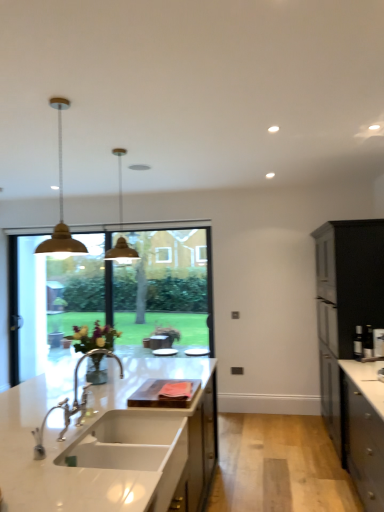
Question: Can you confirm if white glossy sink at center is smaller than gold matte pendant light at upper left?

Choices:
 (A) no
 (B) yes

Answer: (A)

Question: Can you confirm if white glossy sink at center is thinner than gold matte pendant light at upper left?

Choices:
 (A) no
 (B) yes

Answer: (A)

Question: Is gold matte pendant light at upper left located within white glossy sink at center?

Choices:
 (A) yes
 (B) no

Answer: (B)

Question: From the image's perspective, is white glossy sink at center above gold matte pendant light at upper left?

Choices:
 (A) yes
 (B) no

Answer: (B)

Question: Is white glossy sink at center behind gold matte pendant light at upper left?

Choices:
 (A) yes
 (B) no

Answer: (B)

Question: Is white glossy sink at center positioned in front of gold matte pendant light at upper left?

Choices:
 (A) yes
 (B) no

Answer: (A)

Question: Is black matte cabinet at right beside white marble countertop at center?

Choices:
 (A) no
 (B) yes

Answer: (A)

Question: Is white marble countertop at center at the back of black matte cabinet at right?

Choices:
 (A) no
 (B) yes

Answer: (A)

Question: From the image's perspective, is black matte cabinet at right located beneath white marble countertop at center?

Choices:
 (A) no
 (B) yes

Answer: (A)

Question: Can you confirm if black matte cabinet at right is bigger than white marble countertop at center?

Choices:
 (A) no
 (B) yes

Answer: (A)

Question: Does black matte cabinet at right lie in front of white marble countertop at center?

Choices:
 (A) yes
 (B) no

Answer: (B)

Question: Is black matte cabinet at right positioned behind white marble countertop at center?

Choices:
 (A) no
 (B) yes

Answer: (B)

Question: Considering the relative sizes of metallic gold pendant light at center and black matte cabinet at right in the image provided, is metallic gold pendant light at center shorter than black matte cabinet at right?

Choices:
 (A) no
 (B) yes

Answer: (B)